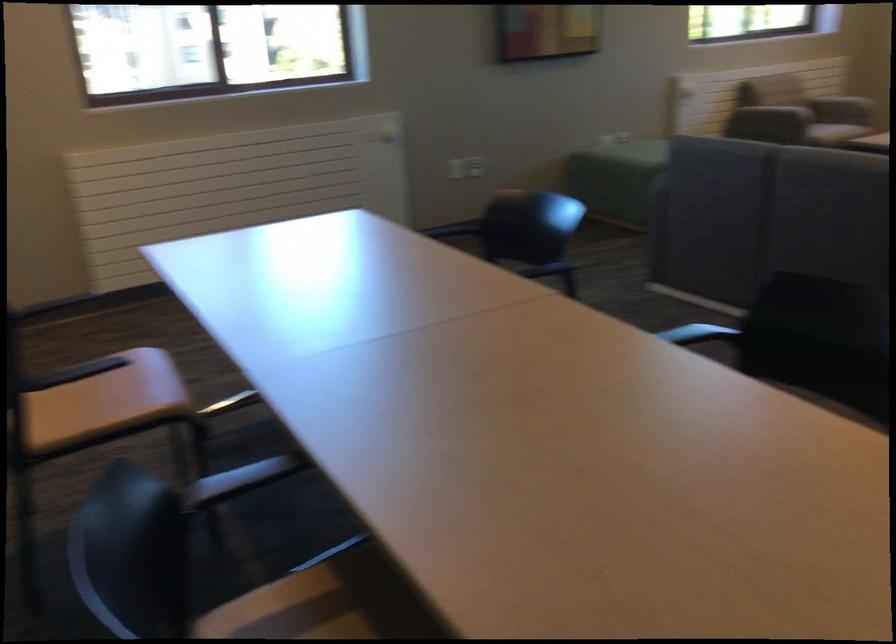
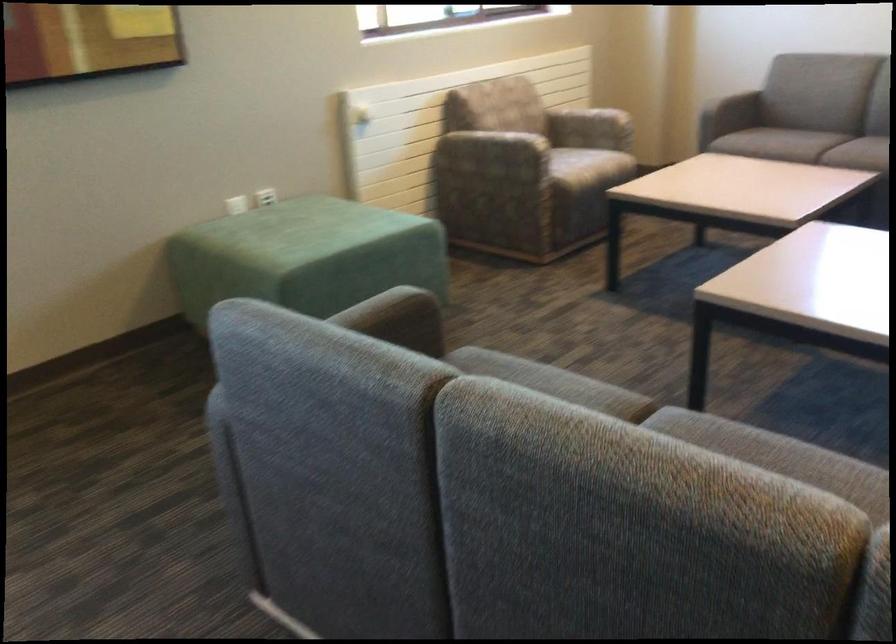
Which direction would the cameraman need to move to produce the second image?

The movement direction of the cameraman is right, forward.